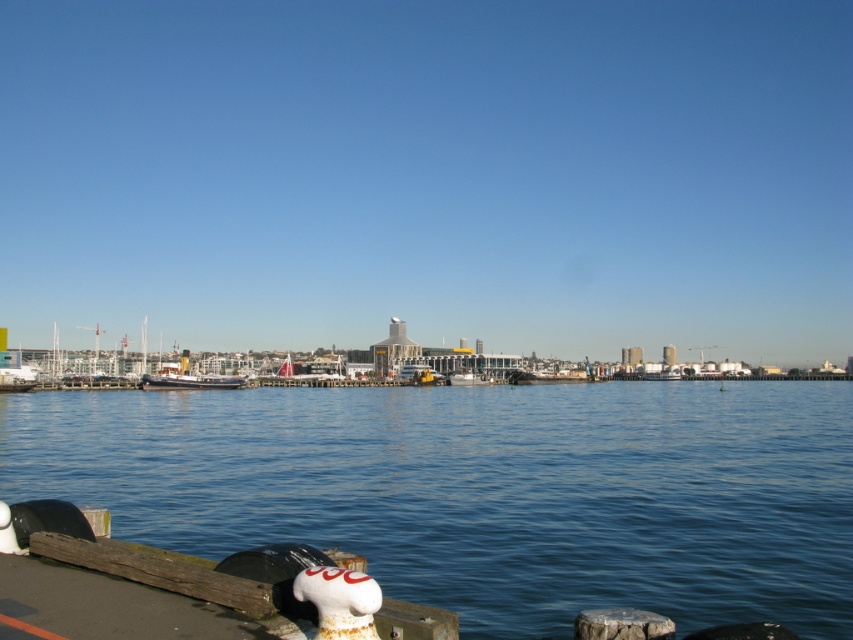
Is point (720, 452) positioned behind point (161, 374)?

That is False.

Identify the location of blue water at center. (485, 490).

Can you confirm if blue water at center is positioned to the left of white matte boat at center?

In fact, blue water at center is to the right of white matte boat at center.

Which is behind, point (199, 422) or point (467, 371)?

The point (467, 371) is more distant.

At what (x,y) coordinates should I click in order to perform the action: click on blue water at center. Please return your answer as a coordinate pair (x, y). Looking at the image, I should click on [x=485, y=490].

Does point (189, 372) come closer to viewer compared to point (453, 376)?

Yes, point (189, 372) is in front of point (453, 376).

Between wooden ship at center and white matte boat at center, which one is positioned lower?

white matte boat at center is lower down.

Does point (173, 376) come in front of point (476, 385)?

Yes, it is.

You are a GUI agent. You are given a task and a screenshot of the screen. Output one action in this format:
    pyautogui.click(x=<x>, y=<y>)
    Task: Click on the wooden ship at center
    The image size is (853, 640).
    Given the screenshot: What is the action you would take?
    pyautogui.click(x=189, y=378)